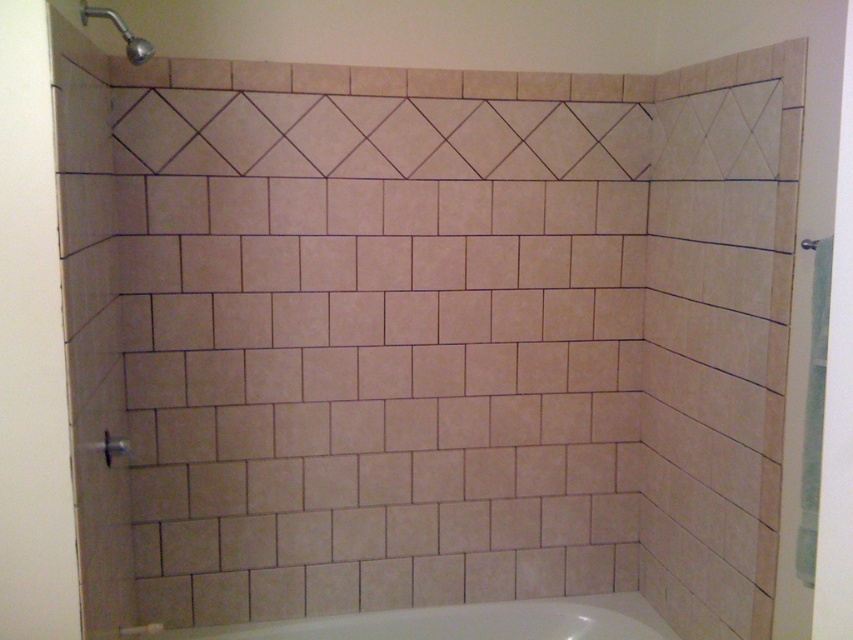
Does point (28, 449) come closer to viewer compared to point (488, 614)?

Yes, it is.

Who is more distant from viewer, (x=32, y=228) or (x=529, y=621)?

Point (x=529, y=621)

At what (x,y) coordinates should I click in order to perform the action: click on matte glass screen door at left. Please return your answer as a coordinate pair (x, y). The image size is (853, 640). Looking at the image, I should click on (32, 346).

Find the location of a particular element. The width and height of the screenshot is (853, 640). matte glass screen door at left is located at coordinates (32, 346).

Between white glossy bathtub at lower center and matte silver shower head at upper left, which one appears on the left side from the viewer's perspective?

matte silver shower head at upper left is more to the left.

Is white glossy bathtub at lower center bigger than matte silver shower head at upper left?

Yes, white glossy bathtub at lower center is bigger than matte silver shower head at upper left.

What are the coordinates of `white glossy bathtub at lower center` in the screenshot? It's located at (457, 621).

Who is higher up, matte glass screen door at left or matte silver shower head at upper left?

matte silver shower head at upper left

Consider the image. Does matte glass screen door at left have a smaller size compared to matte silver shower head at upper left?

Incorrect, matte glass screen door at left is not smaller in size than matte silver shower head at upper left.

Is point (18, 582) farther from camera compared to point (125, 35)?

That is False.

Find the location of a particular element. The width and height of the screenshot is (853, 640). matte glass screen door at left is located at coordinates (32, 346).